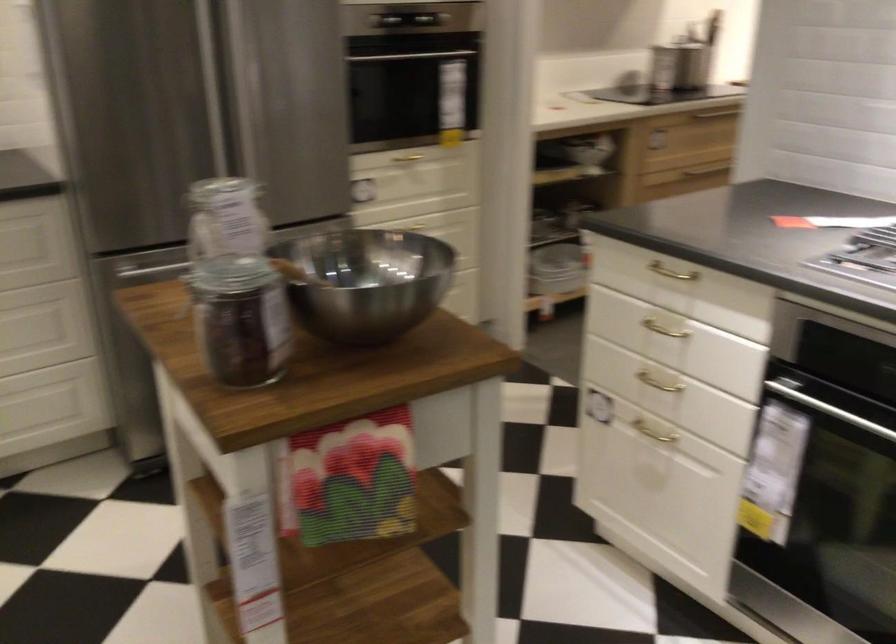
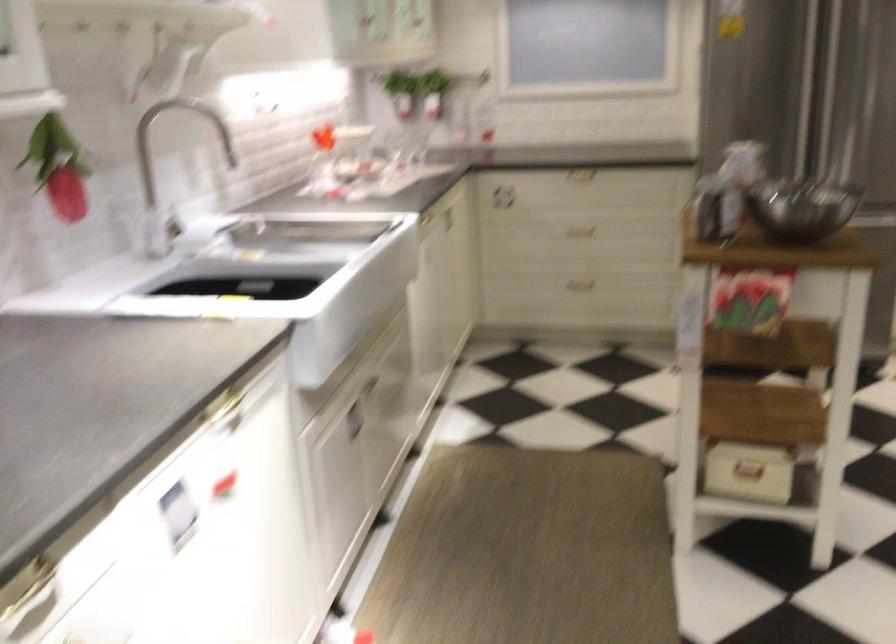
In the second image, find the point that corresponds to (x=218, y=191) in the first image.

(728, 138)